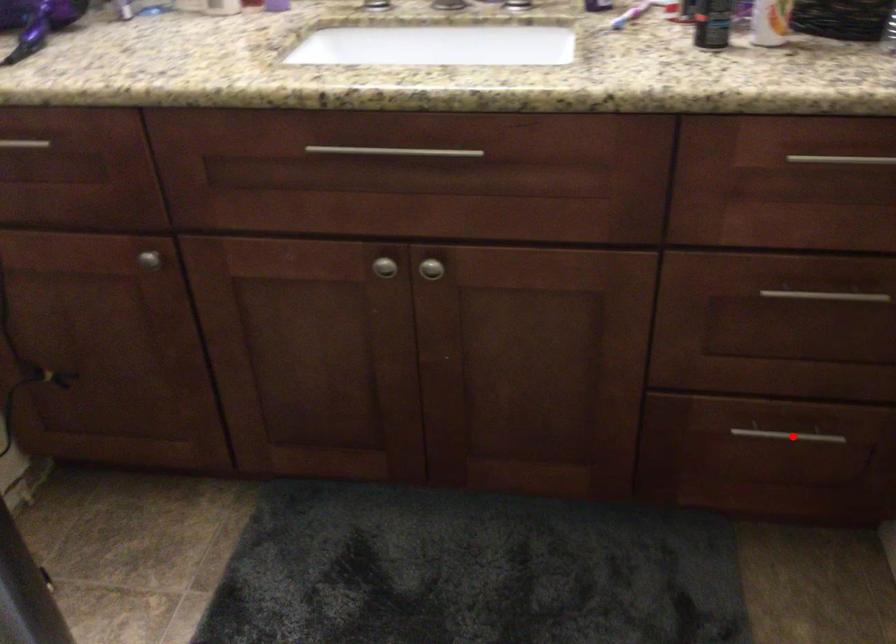
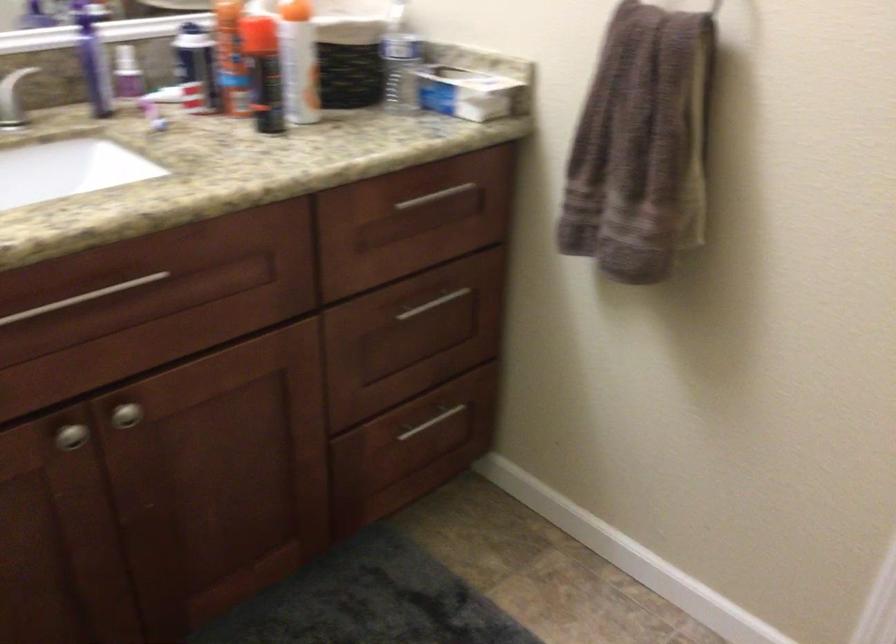
Locate, in the second image, the point that corresponds to the highlighted location in the first image.

(432, 422)